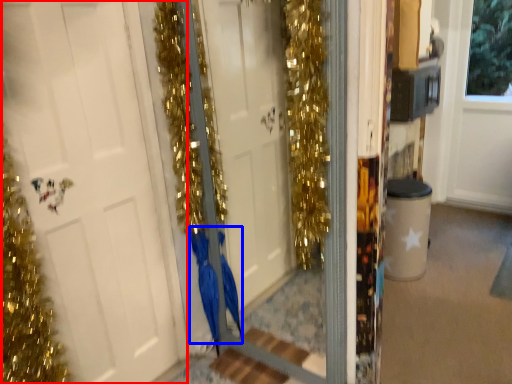
Question: Among these objects, which one is nearest to the camera, door (highlighted by a red box) or dress (highlighted by a blue box)?

Choices:
 (A) door
 (B) dress

Answer: (A)